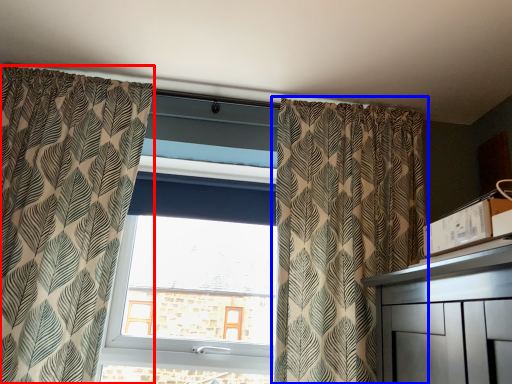
Question: Which object is closer to the camera taking this photo, curtain (highlighted by a red box) or curtain (highlighted by a blue box)?

Choices:
 (A) curtain
 (B) curtain

Answer: (A)